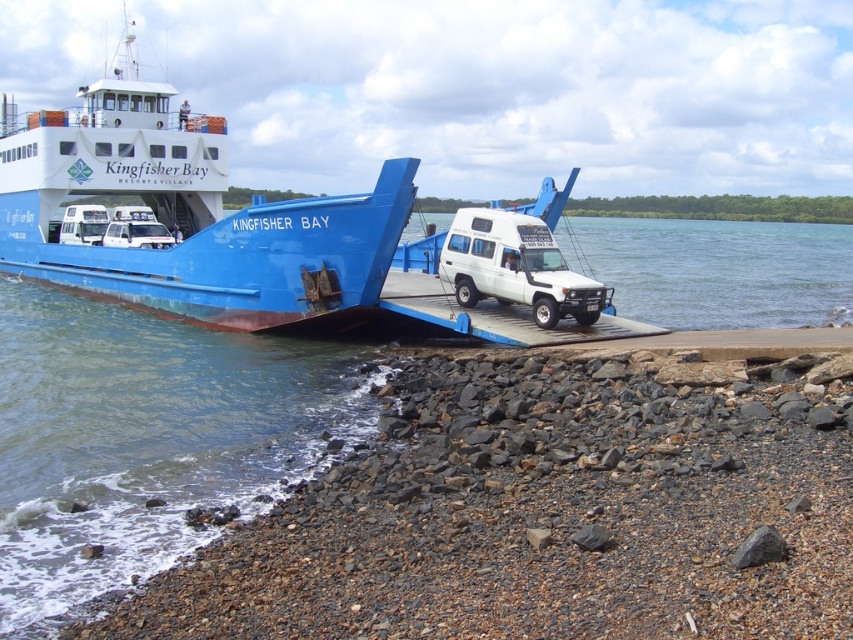
Question: Which point is closer to the camera?

Choices:
 (A) white matte truck at center
 (B) white glossy water at center
 (C) smooth pebbles at lower left
 (D) blue matte ferry at center

Answer: (C)

Question: Which object is the closest to the smooth pebbles at lower left?

Choices:
 (A) white glossy water at center
 (B) blue matte ferry at center

Answer: (B)

Question: Does smooth pebbles at lower left come in front of white matte truck at center?

Choices:
 (A) yes
 (B) no

Answer: (A)

Question: Which point is farther from the camera taking this photo?

Choices:
 (A) (688, 220)
 (B) (157, 184)
 (C) (598, 364)
 (D) (529, 291)

Answer: (A)

Question: Can you confirm if smooth pebbles at lower left is thinner than blue matte ferry at center?

Choices:
 (A) no
 (B) yes

Answer: (B)

Question: Is blue matte ferry at center to the left of white matte truck at center from the viewer's perspective?

Choices:
 (A) yes
 (B) no

Answer: (A)